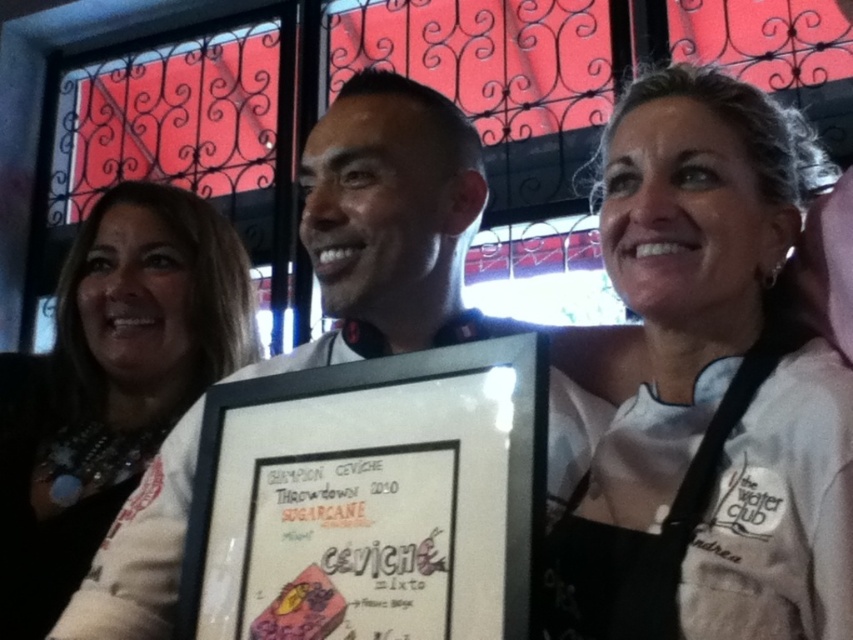
Between white chef's uniform at center and matte white frame at center, which one is positioned lower?

matte white frame at center

Is white chef's uniform at center positioned in front of matte white frame at center?

Yes, white chef's uniform at center is in front of matte white frame at center.

I want to click on white chef's uniform at center, so click(x=711, y=387).

Can you confirm if matte white frame at center is wider than white fabric at center?

Correct, the width of matte white frame at center exceeds that of white fabric at center.

Can you confirm if matte white frame at center is shorter than white fabric at center?

Yes.

Who is more distant from viewer, [347,220] or [33,356]?

The point [33,356] is more distant.

You are a GUI agent. You are given a task and a screenshot of the screen. Output one action in this format:
    pyautogui.click(x=<x>, y=<y>)
    Task: Click on the matte white frame at center
    Image resolution: width=853 pixels, height=640 pixels.
    Given the screenshot: What is the action you would take?
    pyautogui.click(x=389, y=224)

Does matte paper certificate at center have a greater width compared to white fabric at center?

No, matte paper certificate at center is not wider than white fabric at center.

Between point (381, 634) and point (59, 461), which one is positioned behind?

The point (59, 461) is behind.

You are a GUI agent. You are given a task and a screenshot of the screen. Output one action in this format:
    pyautogui.click(x=<x>, y=<y>)
    Task: Click on the matte paper certificate at center
    The image size is (853, 640).
    Given the screenshot: What is the action you would take?
    pyautogui.click(x=370, y=499)

What are the coordinates of `matte paper certificate at center` in the screenshot? It's located at (370, 499).